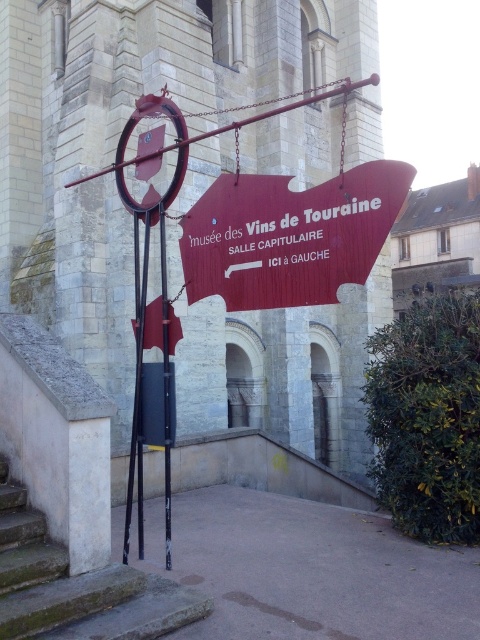
The width and height of the screenshot is (480, 640). I want to click on matte stone church at center, so click(119, 134).

Can you confirm if matte stone church at center is positioned to the right of concrete stairs at lower left?

Correct, you'll find matte stone church at center to the right of concrete stairs at lower left.

Is point (383, 284) farther from viewer compared to point (193, 592)?

Yes, it is.

The width and height of the screenshot is (480, 640). Find the location of `matte stone church at center`. matte stone church at center is located at coordinates (119, 134).

Does point (180, 266) lie in front of point (165, 432)?

No, (180, 266) is further to viewer.

Between matte stone church at center and metallic pole at center, which one appears on the right side from the viewer's perspective?

metallic pole at center

The image size is (480, 640). Find the location of `matte stone church at center`. matte stone church at center is located at coordinates (119, 134).